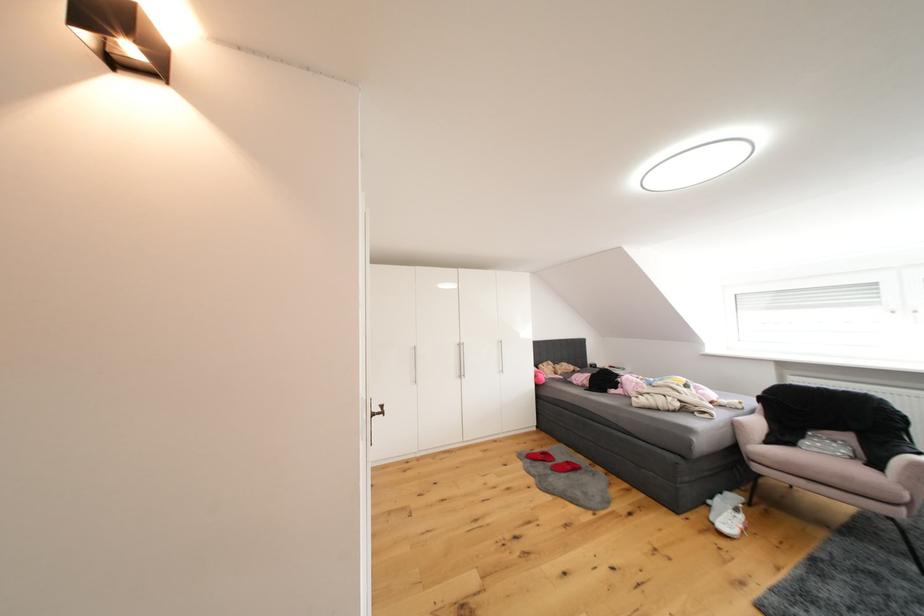
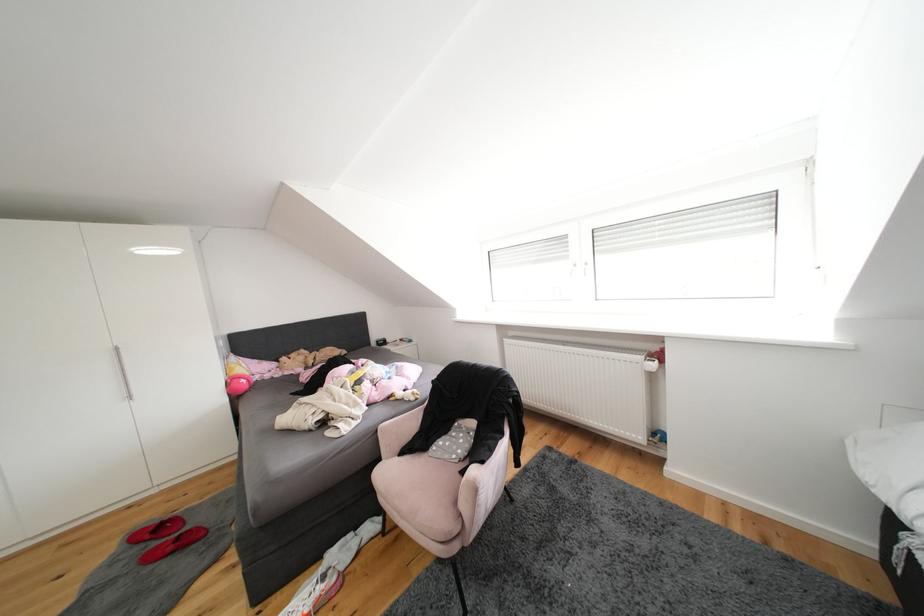
In the second image, find the point that corresponds to point 749,521 in the first image.

(331, 592)